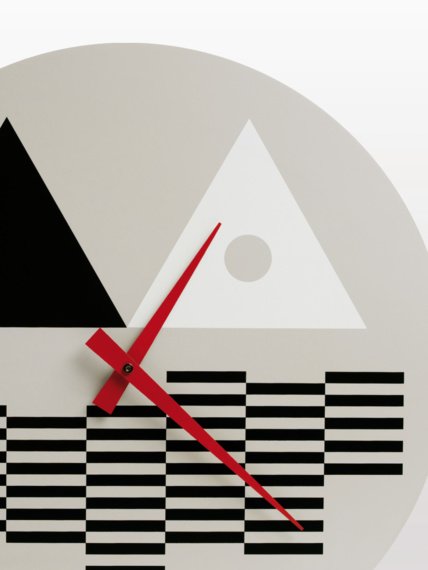
Find the location of a particular element. Image resolution: width=428 pixels, height=570 pixels. bottom right corner empty space is located at coordinates (423, 565).